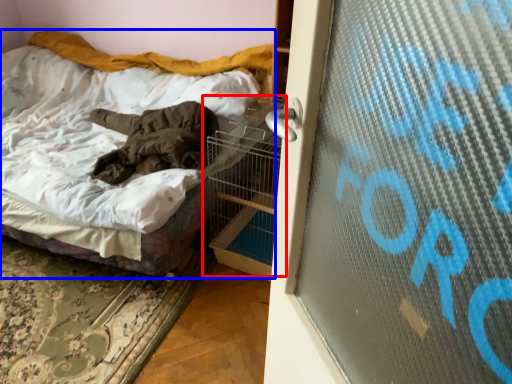
Question: Which object is closer to the camera taking this photo, bird cage (highlighted by a red box) or bed (highlighted by a blue box)?

Choices:
 (A) bird cage
 (B) bed

Answer: (B)